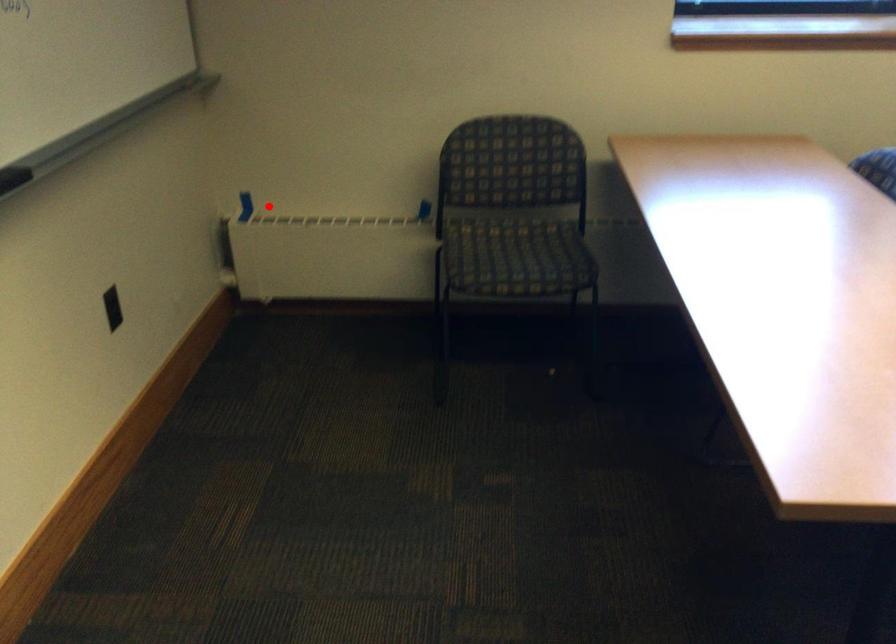
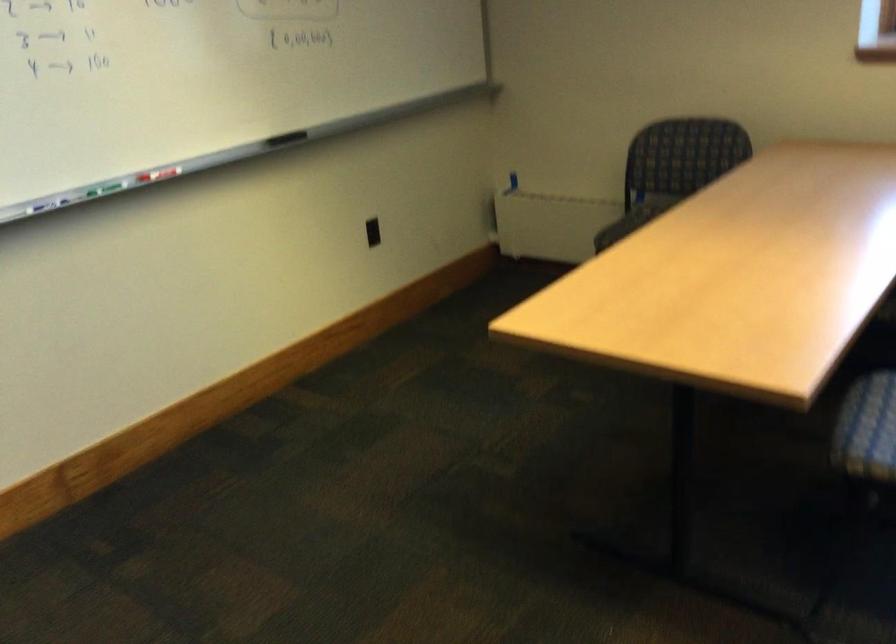
The point at the highlighted location is marked in the first image. Where is the corresponding point in the second image?

(513, 180)